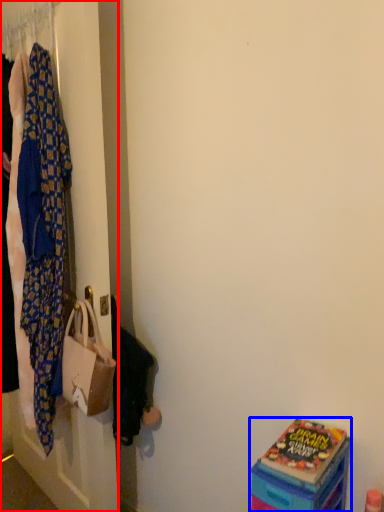
Question: Which of the following is the farthest to the observer, closet (highlighted by a red box) or box (highlighted by a blue box)?

Choices:
 (A) closet
 (B) box

Answer: (A)